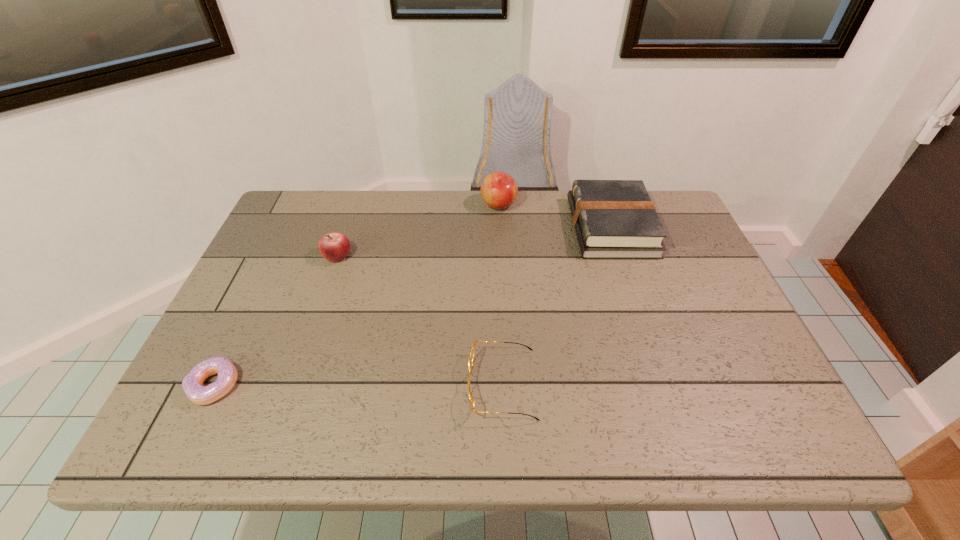
At what (x,y) coordinates should I click in order to perform the action: click on the tallest object. Please return your answer as a coordinate pair (x, y). Image resolution: width=960 pixels, height=540 pixels. Looking at the image, I should click on (499, 190).

At what (x,y) coordinates should I click in order to perform the action: click on the taller apple. Please return your answer as a coordinate pair (x, y). The height and width of the screenshot is (540, 960). Looking at the image, I should click on (499, 190).

Locate an element on the screen. the rightmost object is located at coordinates (614, 219).

The width and height of the screenshot is (960, 540). Identify the location of the left apple. (334, 247).

Locate an element on the screen. The height and width of the screenshot is (540, 960). the nearer apple is located at coordinates (334, 247).

Find the location of a particular element. the fourth tallest object is located at coordinates (471, 357).

Where is `doughnut`? The width and height of the screenshot is (960, 540). doughnut is located at coordinates (192, 384).

Locate an element on the screen. the shortest object is located at coordinates (192, 384).

This screenshot has width=960, height=540. What are the coordinates of `vacant region located on the front of the farther apple` in the screenshot? It's located at (502, 270).

Locate an element on the screen. vacant space located 0.270m on the spine side of the hardback book is located at coordinates (483, 227).